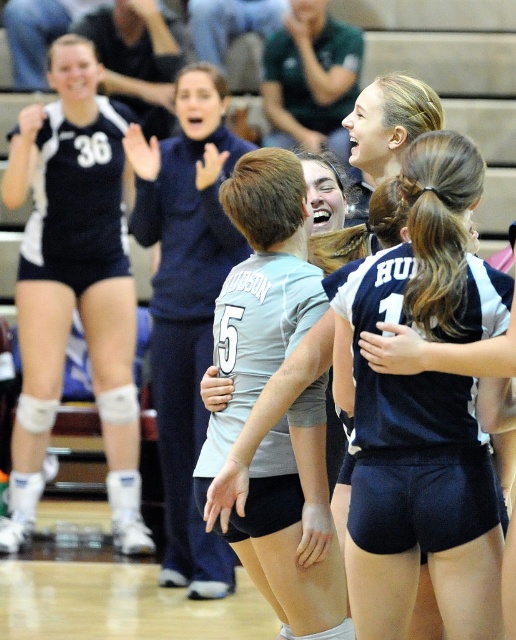
You are standing in the gymnasium and see two points marked in the image. Which point, point (454, 268) or point (231, 157), is closer to you?

Point (454, 268) is closer to the viewer than point (231, 157).

In the scene shown: You are a photographer at the volleyball game and need to capture a photo of both the matte black uniform at center and the matte blue sweatshirt at center. Which object should you focus on first to ensure it appears larger in the photo?

The matte black uniform at center has a larger size compared to the matte blue sweatshirt at center, so you should focus on the matte black uniform at center first to ensure it appears larger in the photo.

You are a photographer at the volleyball game and want to capture a photo of the two uniforms, matte black uniform at center and light gray jersey at center. Since you want the wider uniform to be in focus, which one should you choose?

The matte black uniform at center is wider than the light gray jersey at center, so you should choose the matte black uniform at center to be in focus.